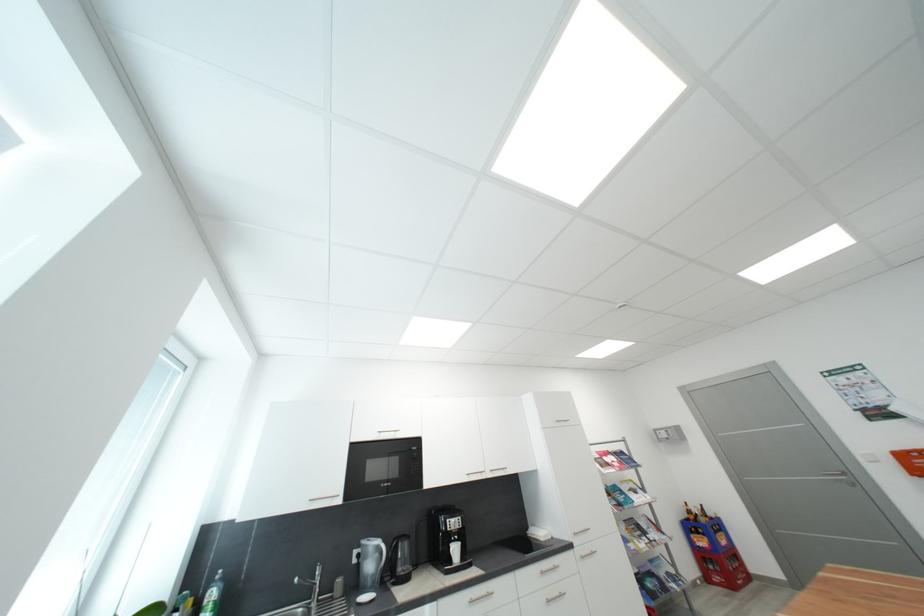
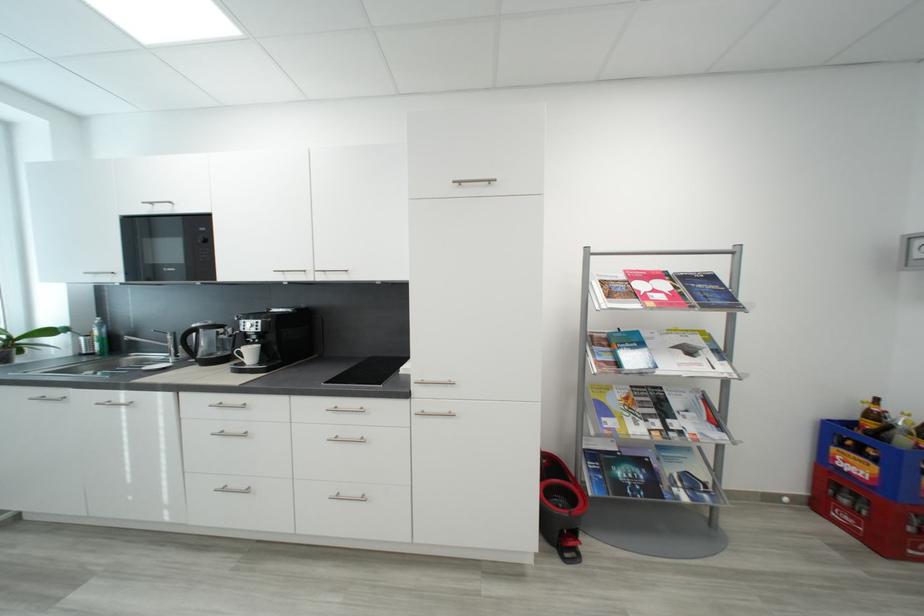
Find the pixel in the second image that matches point 704,533 in the first image.

(867, 454)